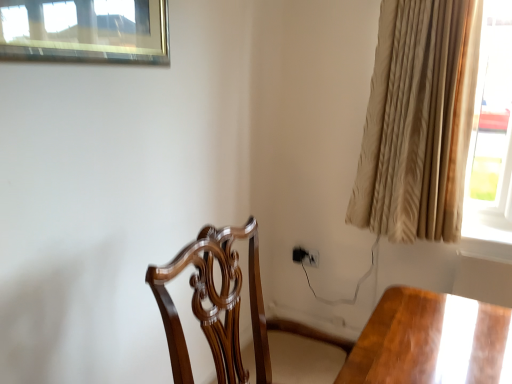
Question: Is beige textured curtain at right positioned beyond the bounds of polished wood chair at center?

Choices:
 (A) yes
 (B) no

Answer: (A)

Question: Considering the relative sizes of beige textured curtain at right and polished wood chair at center in the image provided, is beige textured curtain at right bigger than polished wood chair at center?

Choices:
 (A) no
 (B) yes

Answer: (A)

Question: Is beige textured curtain at right thinner than polished wood chair at center?

Choices:
 (A) no
 (B) yes

Answer: (B)

Question: Does beige textured curtain at right contain polished wood chair at center?

Choices:
 (A) yes
 (B) no

Answer: (B)

Question: Does beige textured curtain at right have a smaller size compared to polished wood chair at center?

Choices:
 (A) yes
 (B) no

Answer: (A)

Question: Does beige textured curtain at right have a greater height compared to polished wood chair at center?

Choices:
 (A) no
 (B) yes

Answer: (B)

Question: Does polished wood chair at center lie in front of beige textured curtain at right?

Choices:
 (A) no
 (B) yes

Answer: (B)

Question: Can you confirm if polished wood chair at center is thinner than beige textured curtain at right?

Choices:
 (A) yes
 (B) no

Answer: (B)

Question: Can you confirm if polished wood chair at center is shorter than beige textured curtain at right?

Choices:
 (A) no
 (B) yes

Answer: (B)

Question: Is polished wood chair at center looking in the opposite direction of beige textured curtain at right?

Choices:
 (A) no
 (B) yes

Answer: (A)

Question: Is polished wood chair at center located outside beige textured curtain at right?

Choices:
 (A) yes
 (B) no

Answer: (A)

Question: Does polished wood chair at center have a smaller size compared to beige textured curtain at right?

Choices:
 (A) no
 (B) yes

Answer: (A)

Question: Considering the positions of point (449, 153) and point (189, 367), is point (449, 153) closer or farther from the camera than point (189, 367)?

Choices:
 (A) closer
 (B) farther

Answer: (B)